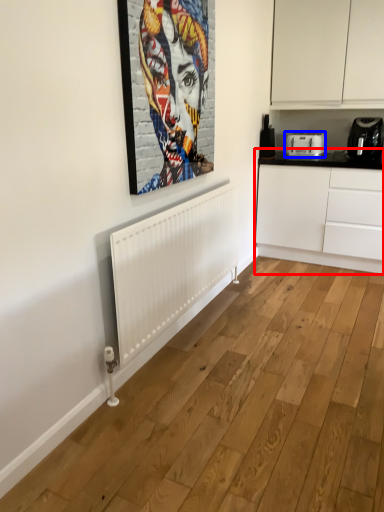
Question: Among these objects, which one is farthest to the camera, cabinetry (highlighted by a red box) or toaster (highlighted by a blue box)?

Choices:
 (A) cabinetry
 (B) toaster

Answer: (B)